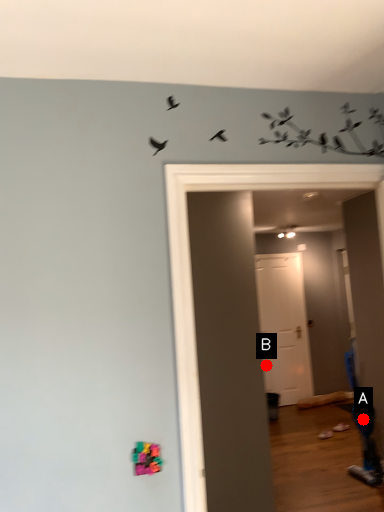
Question: Two points are circled on the image, labeled by A and B beside each circle. Which point is closer to the camera?

Choices:
 (A) A is closer
 (B) B is closer

Answer: (A)